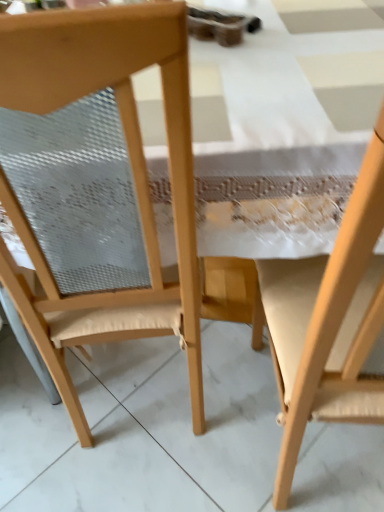
Question: From a real-world perspective, relative to wooden chair at right, marked as the first chair in a right-to-left arrangement, is wooden chair at left, arranged as the 2th chair when viewed from the right, vertically above or below?

Choices:
 (A) below
 (B) above

Answer: (A)

Question: Is point (125, 281) positioned closer to the camera than point (362, 207)?

Choices:
 (A) closer
 (B) farther

Answer: (B)

Question: Is wooden chair at left, placed as the first chair when sorted from left to right, in front of or behind wooden chair at right, marked as the first chair in a right-to-left arrangement, in the image?

Choices:
 (A) behind
 (B) front

Answer: (A)

Question: From the image's perspective, is wooden chair at right, marked as the first chair in a right-to-left arrangement, above or below wooden chair at left, placed as the first chair when sorted from left to right?

Choices:
 (A) below
 (B) above

Answer: (A)

Question: In the image, is wooden chair at right, which is the second chair from left to right, positioned in front of or behind wooden chair at left, arranged as the 2th chair when viewed from the right?

Choices:
 (A) front
 (B) behind

Answer: (A)

Question: Based on their positions, is wooden chair at right, marked as the first chair in a right-to-left arrangement, located to the left or right of wooden chair at left, arranged as the 2th chair when viewed from the right?

Choices:
 (A) left
 (B) right

Answer: (B)

Question: Is point (271, 309) positioned closer to the camera than point (39, 20)?

Choices:
 (A) farther
 (B) closer

Answer: (A)